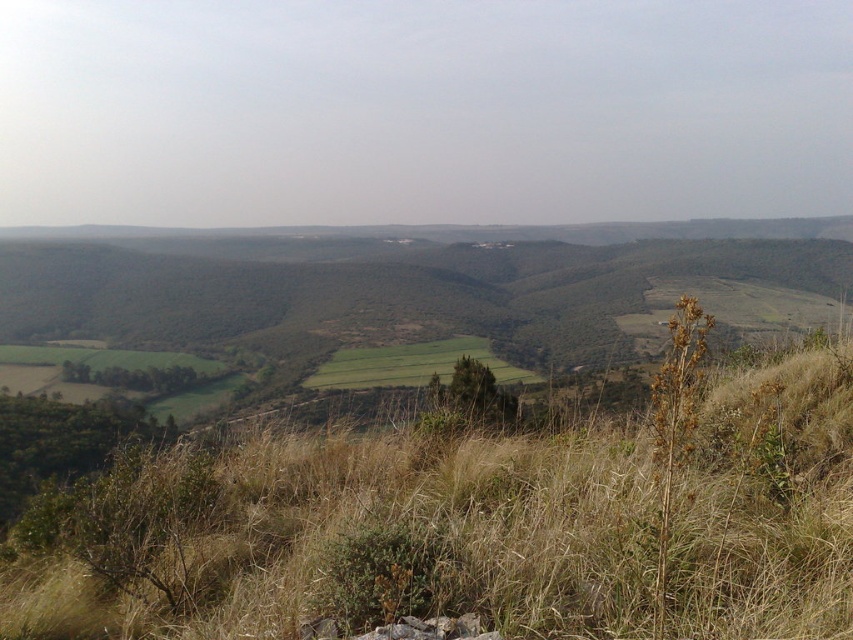
Can you confirm if brown dry grass at center is positioned to the right of green grassy field at center?

Correct, you'll find brown dry grass at center to the right of green grassy field at center.

Describe the element at coordinates (473, 524) in the screenshot. The image size is (853, 640). I see `brown dry grass at center` at that location.

I want to click on brown dry grass at center, so click(x=473, y=524).